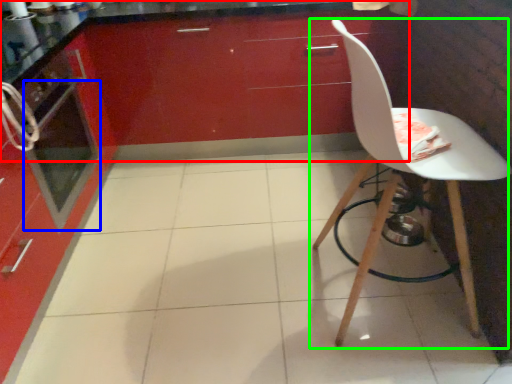
Question: Based on their relative distances, which object is farther from cabinetry (highlighted by a red box)? Choose from oven (highlighted by a blue box) and chair (highlighted by a green box).

Choices:
 (A) oven
 (B) chair

Answer: (B)